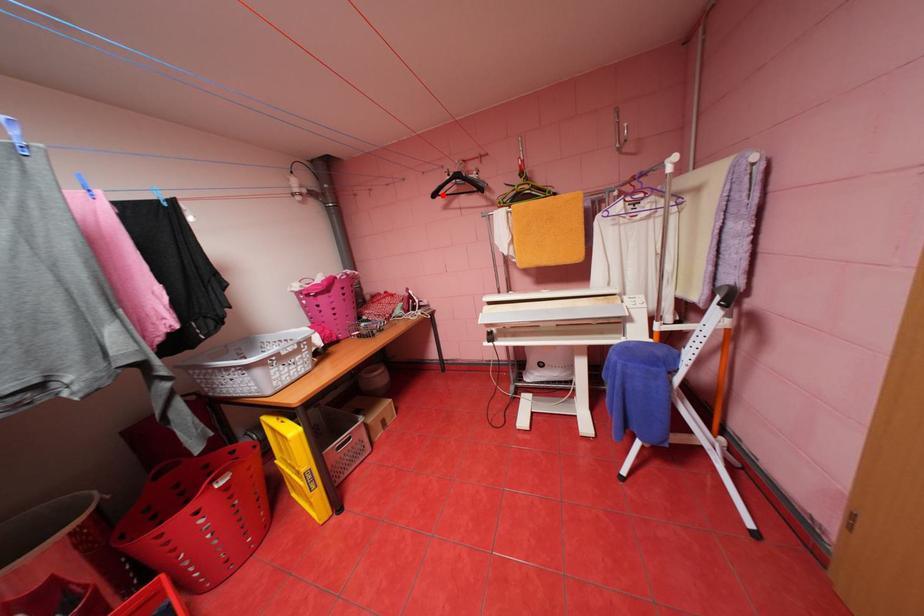
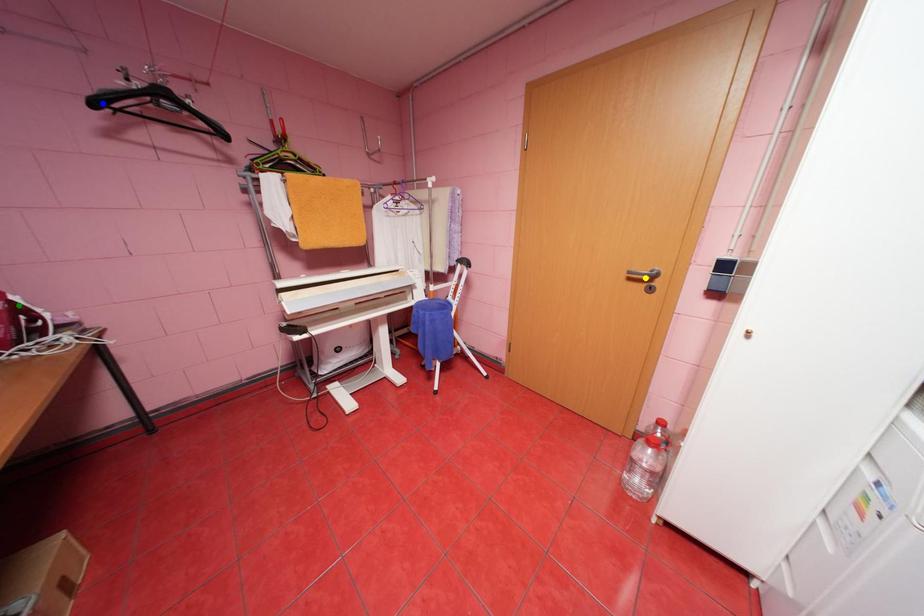
Question: I am providing you with two images of the same scene from different viewpoints. A red point is marked on the first image. You are given multiple points on the second image. Which mark in image 2 goes with the point in image 1?

Choices:
 (A) blue point
 (B) green point
 (C) yellow point

Answer: (A)